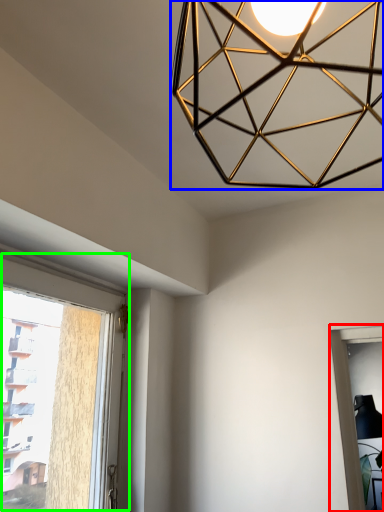
Question: Considering the real-world distances, which object is closest to window (highlighted by a red box)? lamp (highlighted by a blue box) or window (highlighted by a green box).

Choices:
 (A) lamp
 (B) window

Answer: (A)